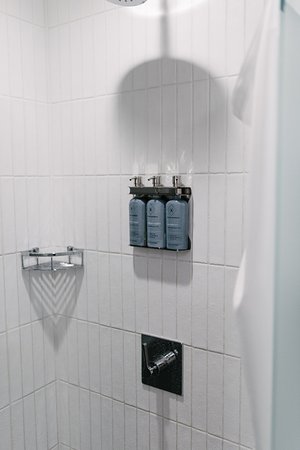
The height and width of the screenshot is (450, 300). I want to click on stall tiles, so click(x=94, y=345), click(x=166, y=311), click(x=34, y=347).